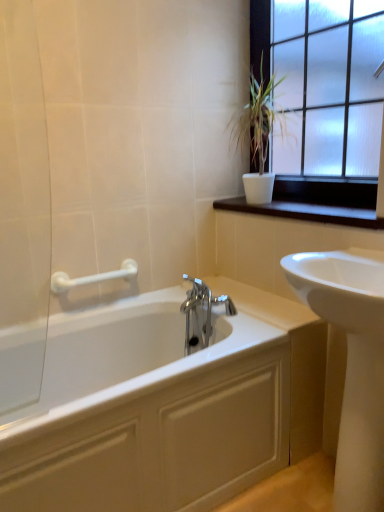
Question: Is frosted glass window at upper right to the right of white glossy sink at right from the viewer's perspective?

Choices:
 (A) yes
 (B) no

Answer: (B)

Question: From a real-world perspective, is frosted glass window at upper right on white glossy sink at right?

Choices:
 (A) no
 (B) yes

Answer: (B)

Question: Is frosted glass window at upper right aimed at white glossy sink at right?

Choices:
 (A) yes
 (B) no

Answer: (B)

Question: Considering the relative sizes of frosted glass window at upper right and white glossy sink at right in the image provided, is frosted glass window at upper right wider than white glossy sink at right?

Choices:
 (A) yes
 (B) no

Answer: (B)

Question: Can you confirm if frosted glass window at upper right is bigger than white glossy sink at right?

Choices:
 (A) no
 (B) yes

Answer: (A)

Question: Is frosted glass window at upper right to the left of white glossy sink at right from the viewer's perspective?

Choices:
 (A) yes
 (B) no

Answer: (A)

Question: From the image's perspective, is dark wood window sill at upper right located above white ceramic plant at upper right?

Choices:
 (A) yes
 (B) no

Answer: (B)

Question: Is dark wood window sill at upper right beside white ceramic plant at upper right?

Choices:
 (A) no
 (B) yes

Answer: (A)

Question: Is dark wood window sill at upper right oriented away from white ceramic plant at upper right?

Choices:
 (A) no
 (B) yes

Answer: (A)

Question: Is dark wood window sill at upper right further to the viewer compared to white ceramic plant at upper right?

Choices:
 (A) yes
 (B) no

Answer: (B)

Question: Is dark wood window sill at upper right to the left of white ceramic plant at upper right from the viewer's perspective?

Choices:
 (A) no
 (B) yes

Answer: (A)

Question: Considering the relative sizes of dark wood window sill at upper right and white ceramic plant at upper right in the image provided, is dark wood window sill at upper right thinner than white ceramic plant at upper right?

Choices:
 (A) yes
 (B) no

Answer: (A)

Question: Is white plastic grab bar at upper left looking in the opposite direction of frosted glass window at upper right?

Choices:
 (A) yes
 (B) no

Answer: (B)